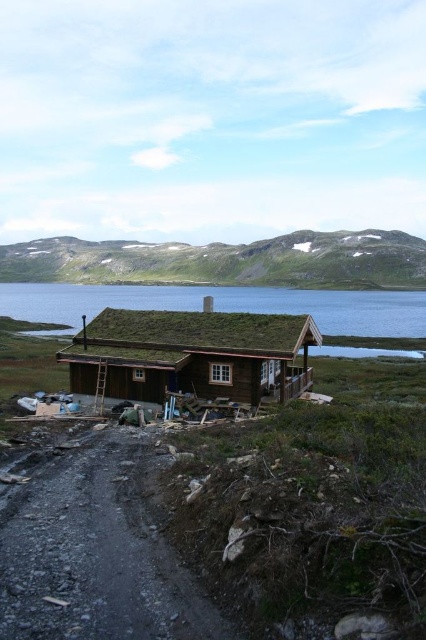
Question: Which object is the closest to the clear blue water at center?

Choices:
 (A) brown wooden log cabin at center
 (B) dusty gravel path at lower left

Answer: (A)

Question: Does brown wooden log cabin at center have a smaller size compared to clear blue water at center?

Choices:
 (A) no
 (B) yes

Answer: (B)

Question: Which of the following is the closest to the observer?

Choices:
 (A) dusty gravel path at lower left
 (B) brown wooden log cabin at center
 (C) clear blue water at center

Answer: (A)

Question: Which of the following is the closest to the observer?

Choices:
 (A) brown wooden log cabin at center
 (B) dusty gravel path at lower left

Answer: (B)

Question: In this image, where is brown wooden log cabin at center located relative to clear blue water at center?

Choices:
 (A) right
 (B) left

Answer: (A)

Question: Does dusty gravel path at lower left appear under clear blue water at center?

Choices:
 (A) no
 (B) yes

Answer: (B)